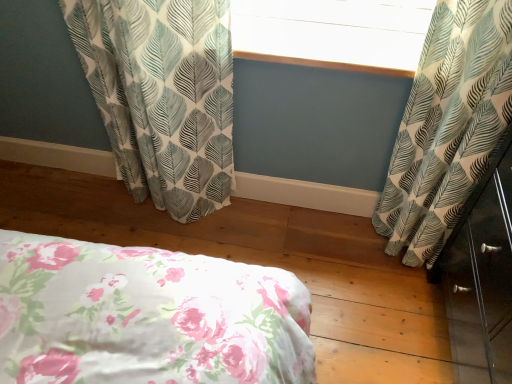
Image resolution: width=512 pixels, height=384 pixels. Identify the location of free space to the left of white leaf-patterned curtain at right, which ranks as the first curtain in right-to-left order. (334, 240).